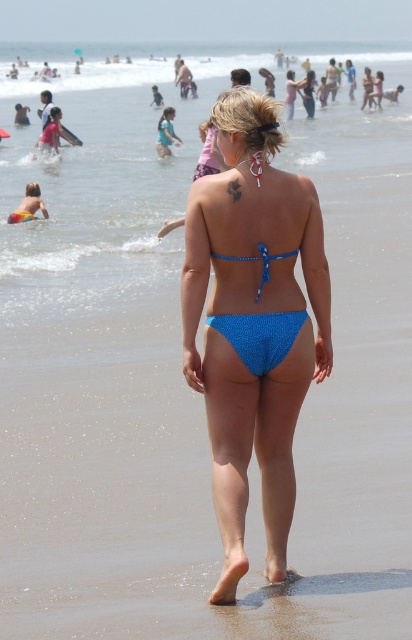
You are a photographer trying to capture a closeup shot of the blue glittery bikini bottom at center and light blue fabric bikini top at upper center. Which one is located to the right of the other?

The blue glittery bikini bottom at center is positioned on the right side of light blue fabric bikini top at upper center.

You are a photographer trying to capture the woman in the blue fabric bikini at center and the light blue fabric bikini top at upper center. Which one should you focus on to ensure it appears larger in your photo?

The blue fabric bikini at center should be focused on because it is taller than the light blue fabric bikini top at upper center, making it appear larger in the photo.